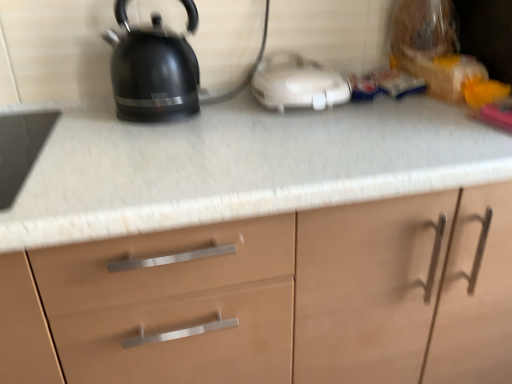
Question: From a real-world perspective, does white plastic toaster at center sit lower than matte wood cabinet at center?

Choices:
 (A) yes
 (B) no

Answer: (B)

Question: Is white plastic toaster at center to the left of matte wood cabinet at center from the viewer's perspective?

Choices:
 (A) yes
 (B) no

Answer: (B)

Question: Is the position of white plastic toaster at center more distant than that of matte wood cabinet at center?

Choices:
 (A) yes
 (B) no

Answer: (A)

Question: From the image's perspective, is white plastic toaster at center on top of matte wood cabinet at center?

Choices:
 (A) no
 (B) yes

Answer: (B)

Question: Is white plastic toaster at center surrounding matte wood cabinet at center?

Choices:
 (A) no
 (B) yes

Answer: (A)

Question: From the image's perspective, is white plastic toaster at center positioned above or below black glossy kettle at upper left?

Choices:
 (A) below
 (B) above

Answer: (A)

Question: From a real-world perspective, is white plastic toaster at center physically located above or below black glossy kettle at upper left?

Choices:
 (A) below
 (B) above

Answer: (A)

Question: Is white plastic toaster at center inside or outside of black glossy kettle at upper left?

Choices:
 (A) inside
 (B) outside

Answer: (B)

Question: Is white plastic toaster at center bigger or smaller than black glossy kettle at upper left?

Choices:
 (A) small
 (B) big

Answer: (A)

Question: Is point (384, 216) positioned closer to the camera than point (197, 61)?

Choices:
 (A) closer
 (B) farther

Answer: (A)

Question: Relative to black glossy kettle at upper left, is matte wood cabinet at center in front or behind?

Choices:
 (A) front
 (B) behind

Answer: (A)

Question: Would you say matte wood cabinet at center is to the left or to the right of black glossy kettle at upper left in the picture?

Choices:
 (A) left
 (B) right

Answer: (B)

Question: From a real-world perspective, is matte wood cabinet at center above or below black glossy kettle at upper left?

Choices:
 (A) above
 (B) below

Answer: (B)

Question: Is white plastic toaster at center taller or shorter than matte wood cabinet at center?

Choices:
 (A) short
 (B) tall

Answer: (A)

Question: Is white plastic toaster at center bigger or smaller than matte wood cabinet at center?

Choices:
 (A) small
 (B) big

Answer: (A)